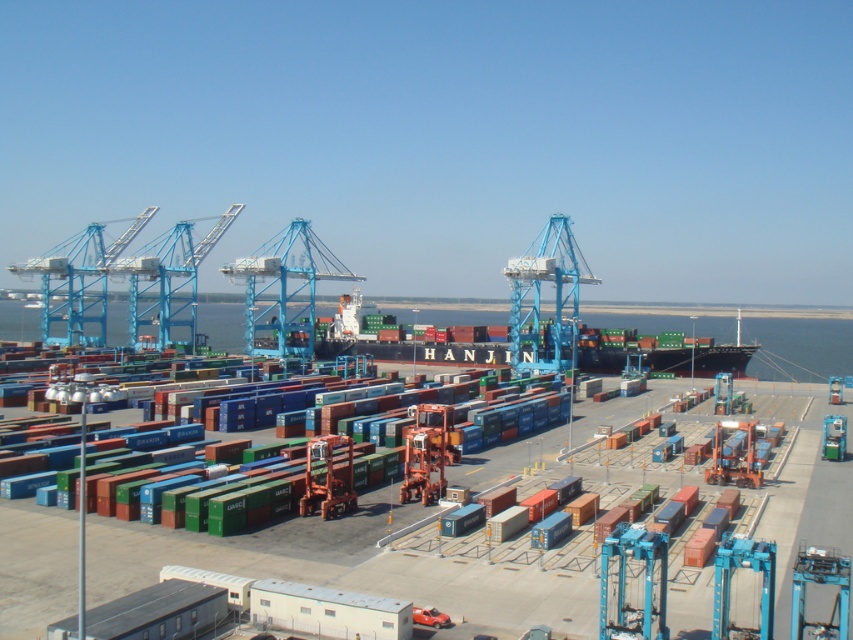
You are a port worker who needs to move a heavy container from the blue metallic crane at left to the green matte container ship at center. Based on their positions, which object should you place the container on first?

The green matte container ship at center is positioned on the right side of the blue metallic crane at left. Therefore, you should place the container on the blue metallic crane at left first before transferring it to the green matte container ship at center.

You are standing at the edge of the port and want to locate the black matte water at center. Based on the coordinates provided, where would you look relative to the cargo ship?

The black matte water at center is located at coordinates point 0.544 on the x axis and 0.938 on the y axis, so you should look towards the lower middle area relative to the cargo ship.